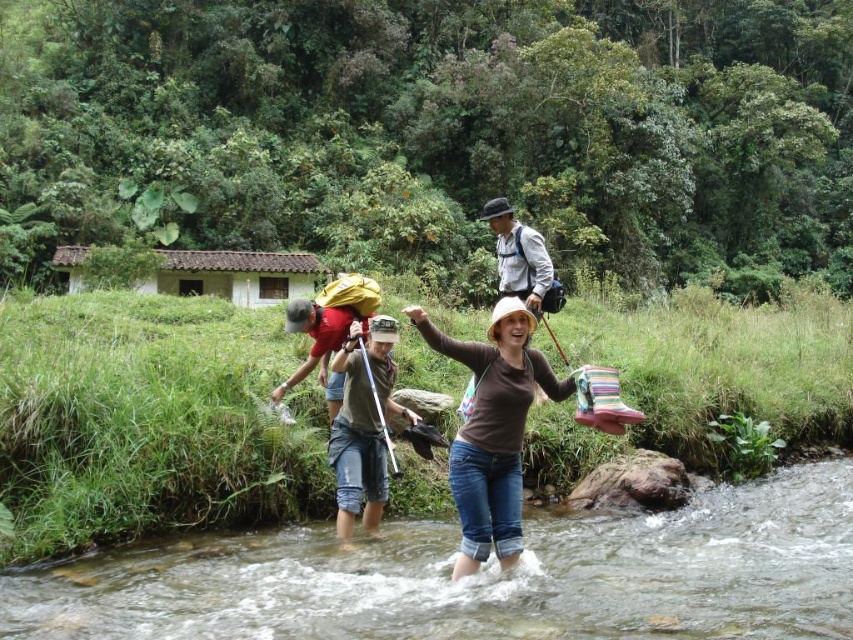
Consider the image. Is brown matte shirt at center above brown cotton shirt at center?

Yes.

Locate an element on the screen. This screenshot has height=640, width=853. brown matte shirt at center is located at coordinates (492, 429).

Where is `brown matte shirt at center`? brown matte shirt at center is located at coordinates (492, 429).

Can you confirm if clear water at river center is bigger than brown cotton shirt at center?

No, clear water at river center is not bigger than brown cotton shirt at center.

Is clear water at river center to the right of brown cotton shirt at center from the viewer's perspective?

No, clear water at river center is not to the right of brown cotton shirt at center.

Between point (688, 515) and point (350, 362), which one is positioned behind?

The point (688, 515) is more distant.

This screenshot has width=853, height=640. In order to click on clear water at river center in this screenshot , I will do `click(482, 577)`.

Which of these two, clear water at river center or brown matte shirt at center, stands taller?

brown matte shirt at center

Can you confirm if clear water at river center is positioned below brown matte shirt at center?

Yes, clear water at river center is below brown matte shirt at center.

Is point (300, 605) less distant than point (543, 356)?

Yes, point (300, 605) is closer to viewer.

You are a GUI agent. You are given a task and a screenshot of the screen. Output one action in this format:
    pyautogui.click(x=<x>, y=<y>)
    Task: Click on the clear water at river center
    Image resolution: width=853 pixels, height=640 pixels.
    Given the screenshot: What is the action you would take?
    pyautogui.click(x=482, y=577)